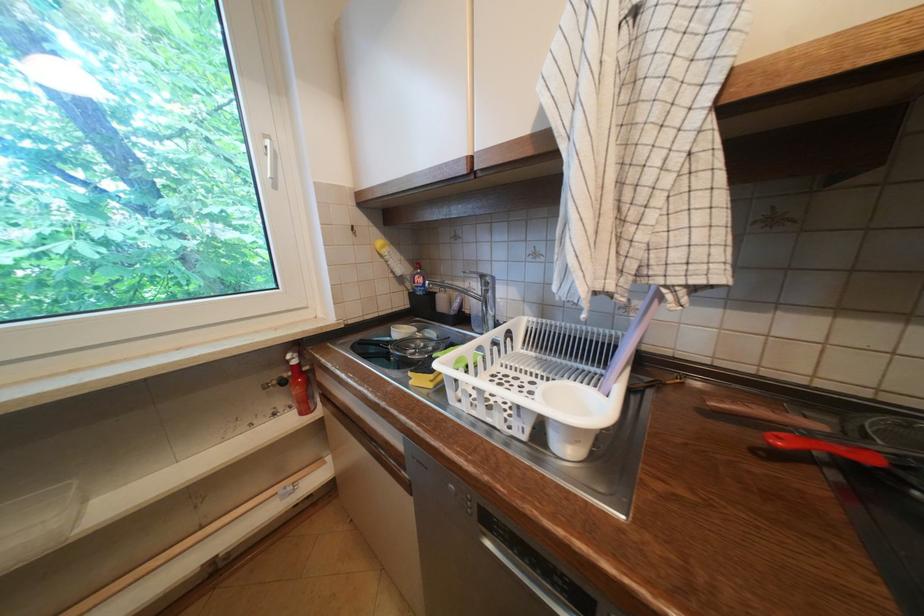
Locate an element on the screen. soap dispenser pump is located at coordinates (299, 385).